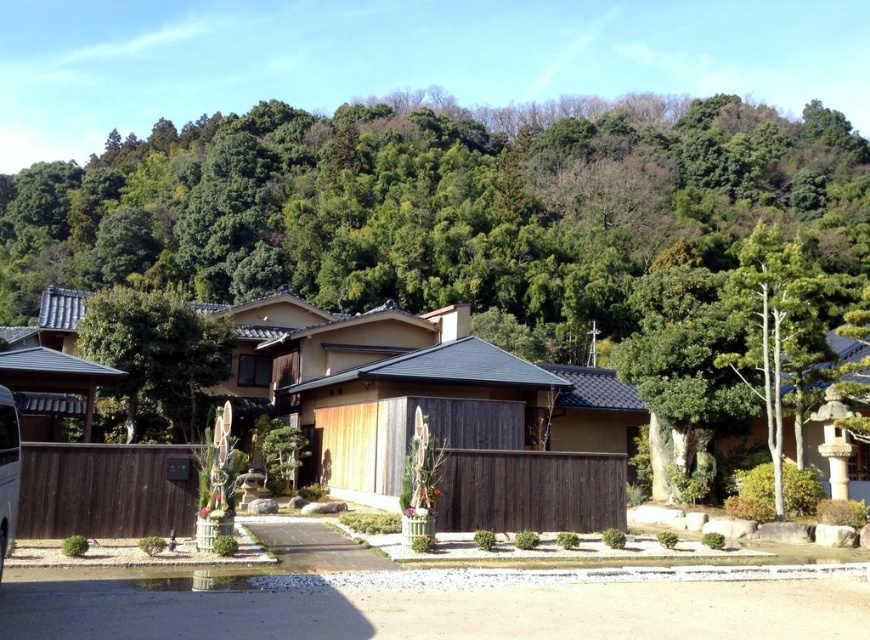
You are standing in front of the traditional Japanese houses and want to determine the relative positions of two points marked in the image. Which point is closer to you, point (771, 237) or point (5, 460)?

Point (771, 237) is further to the viewer than point (5, 460), so the point closer to you is point (5, 460).

You are a visitor arriving at the Japanese village and see the green leafy tree at center and the metallic silver van at lower left. Which object is positioned higher in the image?

The green leafy tree at center is located above the metallic silver van at lower left, so it is positioned higher in the image.